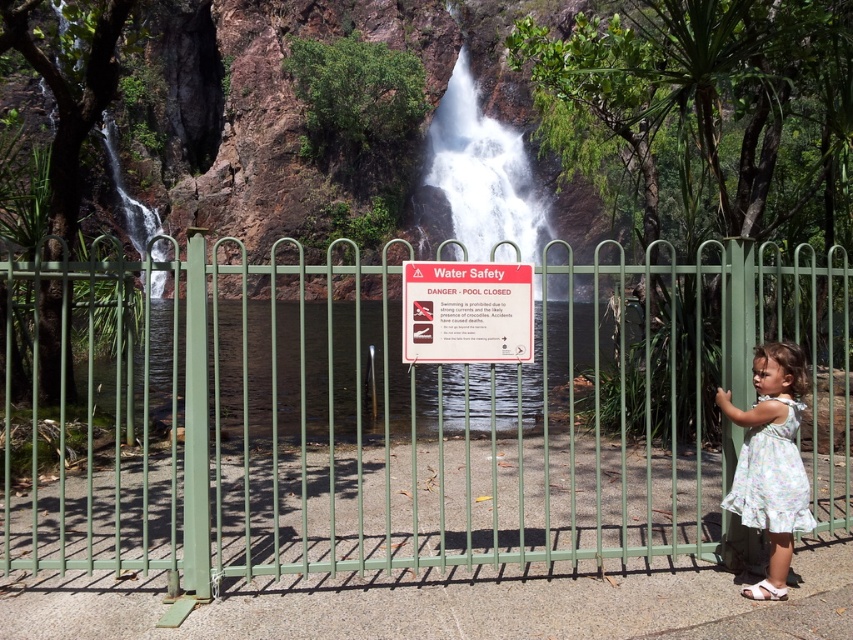
Question: Can you confirm if white frothy water at center is positioned to the left of floral dress at center?

Choices:
 (A) no
 (B) yes

Answer: (A)

Question: Can you confirm if green metal fence at center is wider than white frothy water at center?

Choices:
 (A) no
 (B) yes

Answer: (B)

Question: Which object is closer to the camera taking this photo?

Choices:
 (A) white frothy water at center
 (B) green metal fence at center

Answer: (B)

Question: Which point appears closest to the camera in this image?

Choices:
 (A) (461, 314)
 (B) (793, 502)
 (C) (440, 166)
 (D) (341, 320)

Answer: (B)

Question: Which point appears farthest from the camera in this image?

Choices:
 (A) (474, 200)
 (B) (759, 481)
 (C) (426, 339)

Answer: (A)

Question: Can you confirm if green metal fence at center is smaller than floral dress at center?

Choices:
 (A) no
 (B) yes

Answer: (A)